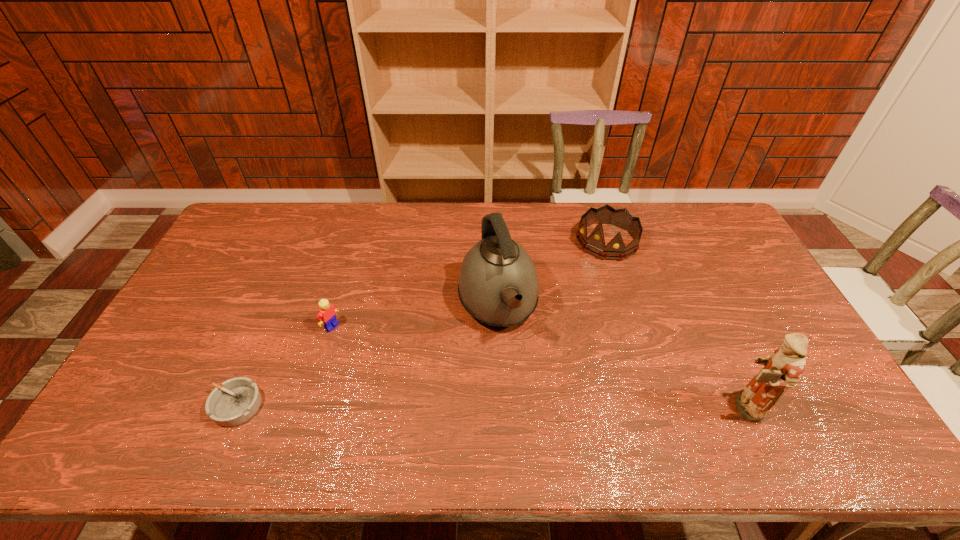
The image size is (960, 540). I want to click on vacant space on the desktop that is between the ashtray and the figurine and is positioned at the spout of the kettle, so click(x=533, y=406).

You are a GUI agent. You are given a task and a screenshot of the screen. Output one action in this format:
    pyautogui.click(x=<x>, y=<y>)
    Task: Click on the vacant space on the desktop that is between the shortest object and the figurine and is positioned on the front-facing side of the fourth object from right to left
    The width and height of the screenshot is (960, 540).
    Given the screenshot: What is the action you would take?
    pyautogui.click(x=454, y=406)

Identify the location of free space on the desktop that is between the leftmost object and the figurine and is positioned at the front of the tiara with jewels. (452, 406).